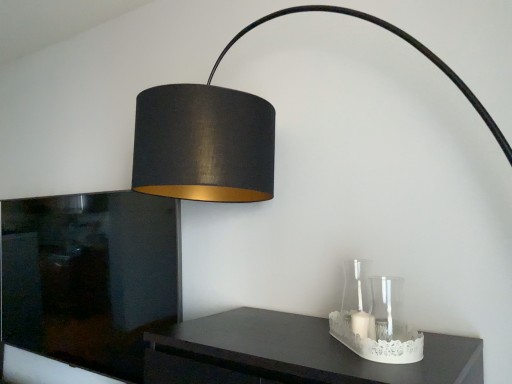
What is the approximate height of transparent glass vase at lower right, acting as the first glass vase starting from the front?

transparent glass vase at lower right, acting as the first glass vase starting from the front, is 5.55 inches tall.

What do you see at coordinates (387, 306) in the screenshot? I see `transparent glass vase at lower right, acting as the first glass vase starting from the front` at bounding box center [387, 306].

Identify the location of transparent glass vase at lower right, which is the second glass vase from back to front. (387, 306).

What do you see at coordinates (356, 286) in the screenshot?
I see `clear glass candle holder at lower right, which appears as the 1th glass vase when viewed from the back` at bounding box center [356, 286].

Find the location of a particular element. This screenshot has width=512, height=384. clear glass candle holder at lower right, which appears as the 1th glass vase when viewed from the back is located at coordinates (356, 286).

The image size is (512, 384). I want to click on transparent glass vase at lower right, which is the second glass vase from back to front, so click(387, 306).

Between clear glass candle holder at lower right, which appears as the 1th glass vase when viewed from the back, and transparent glass vase at lower right, acting as the first glass vase starting from the front, which one appears on the left side from the viewer's perspective?

Positioned to the left is clear glass candle holder at lower right, which appears as the 1th glass vase when viewed from the back.

Considering the positions of objects clear glass candle holder at lower right, which is the second glass vase in front-to-back order, and transparent glass vase at lower right, acting as the first glass vase starting from the front, in the image provided, who is in front, clear glass candle holder at lower right, which is the second glass vase in front-to-back order, or transparent glass vase at lower right, acting as the first glass vase starting from the front,?

transparent glass vase at lower right, acting as the first glass vase starting from the front.

Is point (368, 288) closer or farther from the camera than point (400, 311)?

Point (368, 288) appears to be farther away from the viewer than point (400, 311).

From the picture: From the image's perspective, between clear glass candle holder at lower right, which is the second glass vase in front-to-back order, and transparent glass vase at lower right, which is the second glass vase from back to front, which one is located above?

A: transparent glass vase at lower right, which is the second glass vase from back to front.

From a real-world perspective, between clear glass candle holder at lower right, which appears as the 1th glass vase when viewed from the back, and transparent glass vase at lower right, acting as the first glass vase starting from the front, who is vertically lower?

transparent glass vase at lower right, acting as the first glass vase starting from the front.

Does clear glass candle holder at lower right, which appears as the 1th glass vase when viewed from the back, have a lesser width compared to transparent glass vase at lower right, which is the second glass vase from back to front?

No.

Considering the relative sizes of clear glass candle holder at lower right, which appears as the 1th glass vase when viewed from the back, and transparent glass vase at lower right, acting as the first glass vase starting from the front, in the image provided, is clear glass candle holder at lower right, which appears as the 1th glass vase when viewed from the back, taller than transparent glass vase at lower right, acting as the first glass vase starting from the front,?

Yes.

Does clear glass candle holder at lower right, which appears as the 1th glass vase when viewed from the back, have a larger size compared to transparent glass vase at lower right, which is the second glass vase from back to front?

Correct, clear glass candle holder at lower right, which appears as the 1th glass vase when viewed from the back, is larger in size than transparent glass vase at lower right, which is the second glass vase from back to front.

Can we say clear glass candle holder at lower right, which appears as the 1th glass vase when viewed from the back, lies outside transparent glass vase at lower right, which is the second glass vase from back to front?

Absolutely, clear glass candle holder at lower right, which appears as the 1th glass vase when viewed from the back, is external to transparent glass vase at lower right, which is the second glass vase from back to front.

Is clear glass candle holder at lower right, which is the second glass vase in front-to-back order, far away from transparent glass vase at lower right, acting as the first glass vase starting from the front?

They are positioned close to each other.

Is clear glass candle holder at lower right, which appears as the 1th glass vase when viewed from the back, oriented away from transparent glass vase at lower right, which is the second glass vase from back to front?

No, clear glass candle holder at lower right, which appears as the 1th glass vase when viewed from the back, is not facing the opposite direction of transparent glass vase at lower right, which is the second glass vase from back to front.

How many degrees apart are the facing directions of clear glass candle holder at lower right, which appears as the 1th glass vase when viewed from the back, and transparent glass vase at lower right, acting as the first glass vase starting from the front?

The facing directions of clear glass candle holder at lower right, which appears as the 1th glass vase when viewed from the back, and transparent glass vase at lower right, acting as the first glass vase starting from the front, are 0.000457 degrees apart.

Locate an element on the screen. The width and height of the screenshot is (512, 384). glass vase that appears above the clear glass candle holder at lower right, which is the second glass vase in front-to-back order (from the image's perspective) is located at coordinates click(387, 306).

Considering the positions of objects transparent glass vase at lower right, acting as the first glass vase starting from the front, and clear glass candle holder at lower right, which is the second glass vase in front-to-back order, in the image provided, who is more to the right, transparent glass vase at lower right, acting as the first glass vase starting from the front, or clear glass candle holder at lower right, which is the second glass vase in front-to-back order,?

Positioned to the right is transparent glass vase at lower right, acting as the first glass vase starting from the front.

Considering the positions of objects transparent glass vase at lower right, acting as the first glass vase starting from the front, and clear glass candle holder at lower right, which is the second glass vase in front-to-back order, in the image provided, who is in front, transparent glass vase at lower right, acting as the first glass vase starting from the front, or clear glass candle holder at lower right, which is the second glass vase in front-to-back order,?

transparent glass vase at lower right, acting as the first glass vase starting from the front.

Between point (398, 294) and point (350, 263), which one is positioned in front?

The point (398, 294) is more forward.

From the image's perspective, does transparent glass vase at lower right, which is the second glass vase from back to front, appear lower than clear glass candle holder at lower right, which appears as the 1th glass vase when viewed from the back?

No, from the image's perspective, transparent glass vase at lower right, which is the second glass vase from back to front, is not below clear glass candle holder at lower right, which appears as the 1th glass vase when viewed from the back.

From a real-world perspective, is transparent glass vase at lower right, which is the second glass vase from back to front, physically located above or below clear glass candle holder at lower right, which appears as the 1th glass vase when viewed from the back?

transparent glass vase at lower right, which is the second glass vase from back to front, is below clear glass candle holder at lower right, which appears as the 1th glass vase when viewed from the back.

In terms of width, does transparent glass vase at lower right, which is the second glass vase from back to front, look wider or thinner when compared to clear glass candle holder at lower right, which appears as the 1th glass vase when viewed from the back?

In the image, transparent glass vase at lower right, which is the second glass vase from back to front, appears to be more narrow than clear glass candle holder at lower right, which appears as the 1th glass vase when viewed from the back.

From their relative heights in the image, would you say transparent glass vase at lower right, acting as the first glass vase starting from the front, is taller or shorter than clear glass candle holder at lower right, which appears as the 1th glass vase when viewed from the back?

transparent glass vase at lower right, acting as the first glass vase starting from the front, is shorter than clear glass candle holder at lower right, which appears as the 1th glass vase when viewed from the back.

Who is smaller, transparent glass vase at lower right, which is the second glass vase from back to front, or clear glass candle holder at lower right, which is the second glass vase in front-to-back order?

Smaller between the two is transparent glass vase at lower right, which is the second glass vase from back to front.

Would you say transparent glass vase at lower right, which is the second glass vase from back to front, is outside clear glass candle holder at lower right, which is the second glass vase in front-to-back order?

Yes, transparent glass vase at lower right, which is the second glass vase from back to front, is outside of clear glass candle holder at lower right, which is the second glass vase in front-to-back order.

Does transparent glass vase at lower right, acting as the first glass vase starting from the front, touch clear glass candle holder at lower right, which appears as the 1th glass vase when viewed from the back?

Yes, transparent glass vase at lower right, acting as the first glass vase starting from the front, is in contact with clear glass candle holder at lower right, which appears as the 1th glass vase when viewed from the back.

Is transparent glass vase at lower right, which is the second glass vase from back to front, facing towards clear glass candle holder at lower right, which appears as the 1th glass vase when viewed from the back?

No, transparent glass vase at lower right, which is the second glass vase from back to front, is not turned towards clear glass candle holder at lower right, which appears as the 1th glass vase when viewed from the back.

How different are the orientations of transparent glass vase at lower right, which is the second glass vase from back to front, and clear glass candle holder at lower right, which appears as the 1th glass vase when viewed from the back, in degrees?

There is a 0.000457-degree angle between the facing directions of transparent glass vase at lower right, which is the second glass vase from back to front, and clear glass candle holder at lower right, which appears as the 1th glass vase when viewed from the back.

You are a GUI agent. You are given a task and a screenshot of the screen. Output one action in this format:
    pyautogui.click(x=<x>, y=<y>)
    Task: Click on the glass vase that appears in front of the clear glass candle holder at lower right, which appears as the 1th glass vase when viewed from the back
    
    Given the screenshot: What is the action you would take?
    pyautogui.click(x=387, y=306)

You are a GUI agent. You are given a task and a screenshot of the screen. Output one action in this format:
    pyautogui.click(x=<x>, y=<y>)
    Task: Click on the glass vase on the right of clear glass candle holder at lower right, which is the second glass vase in front-to-back order
    
    Given the screenshot: What is the action you would take?
    pyautogui.click(x=387, y=306)

Where is `glass vase above the transparent glass vase at lower right, which is the second glass vase from back to front (from a real-world perspective)`? This screenshot has width=512, height=384. glass vase above the transparent glass vase at lower right, which is the second glass vase from back to front (from a real-world perspective) is located at coordinates (356, 286).